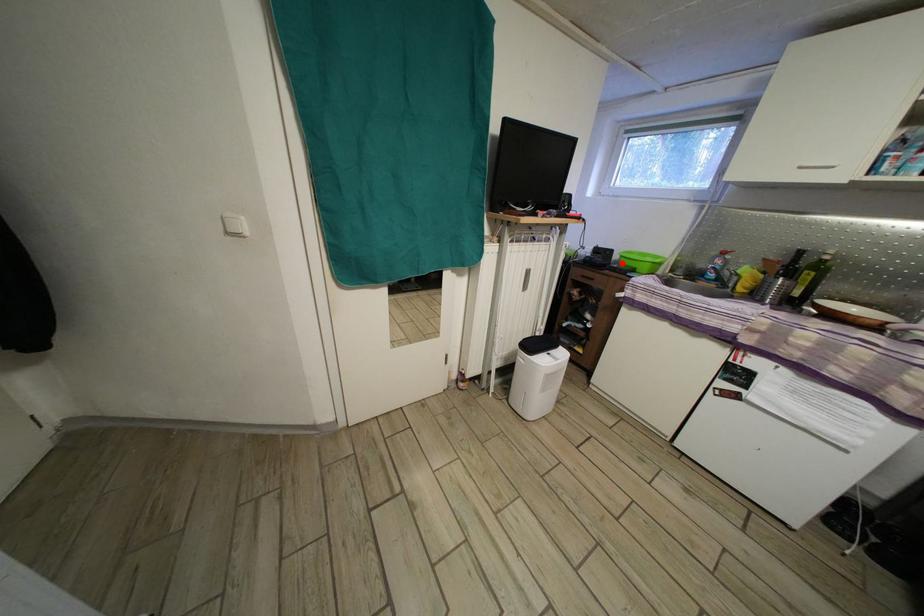
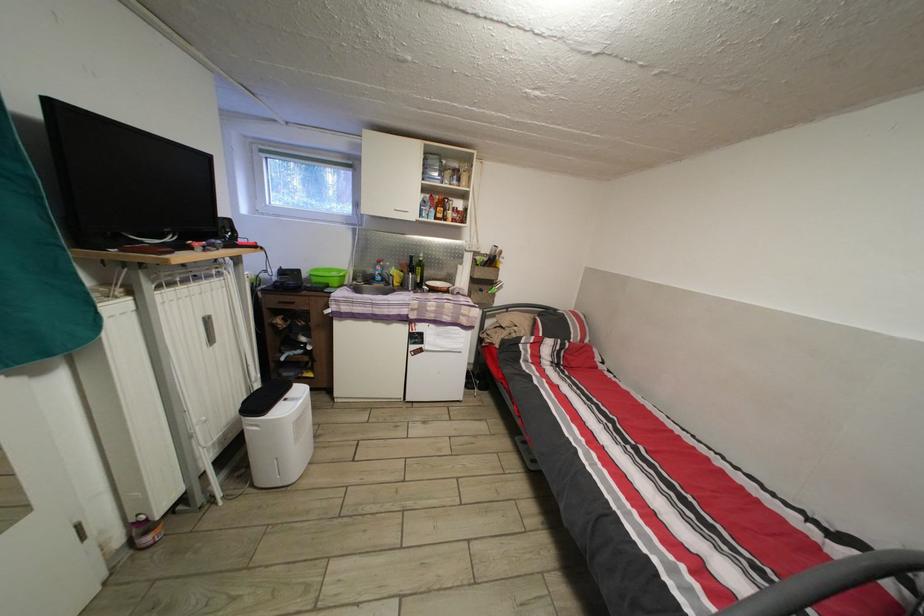
Where in the second image is the point corresponding to the highlighted location from the first image?

(311, 282)